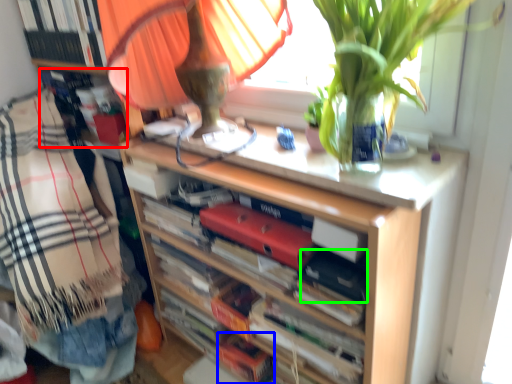
Question: Estimate the real-world distances between objects in this image. Which object is closer to book (highlighted by a red box), book (highlighted by a blue box) or paperback book (highlighted by a green box)?

Choices:
 (A) book
 (B) paperback book

Answer: (A)